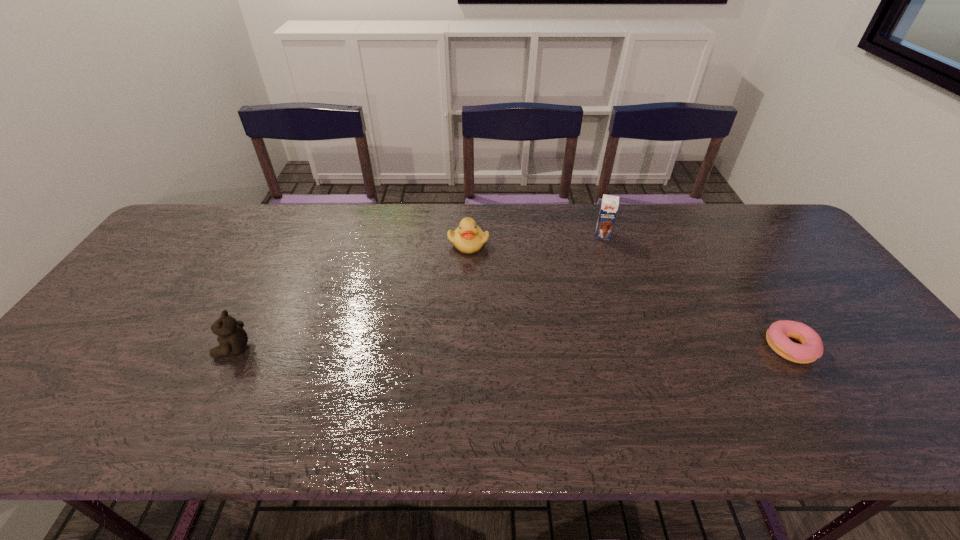
The height and width of the screenshot is (540, 960). Find the location of `vacant space located on the face of the leftmost object`. vacant space located on the face of the leftmost object is located at coordinates (147, 349).

The image size is (960, 540). Identify the location of vacant space located 0.240m on the left of the rightmost object. (668, 347).

At what (x,y) coordinates should I click in order to perform the action: click on vacant space located on the beak of the third tallest object. Please return your answer as a coordinate pair (x, y). The image size is (960, 540). Looking at the image, I should click on (544, 340).

This screenshot has height=540, width=960. What are the coordinates of `vacant point located on the beak of the third tallest object` in the screenshot? It's located at (538, 331).

Image resolution: width=960 pixels, height=540 pixels. Find the location of `vacant area situated 0.090m on the beak of the third tallest object`. vacant area situated 0.090m on the beak of the third tallest object is located at coordinates (492, 272).

Find the location of `vacant space situated 0.110m on the front label of the chocolate milk`. vacant space situated 0.110m on the front label of the chocolate milk is located at coordinates (600, 263).

Locate an element on the screen. free spot located 0.400m on the front label of the chocolate milk is located at coordinates (591, 336).

Identify the location of free space located 0.090m on the front label of the chocolate milk. This screenshot has height=540, width=960. (600, 259).

Locate an element on the screen. The image size is (960, 540). duckling that is at the far edge is located at coordinates coord(468,238).

You are a GUI agent. You are given a task and a screenshot of the screen. Output one action in this format:
    pyautogui.click(x=<x>, y=<y>)
    Task: Click on the chocolate milk at the far edge
    
    Given the screenshot: What is the action you would take?
    pyautogui.click(x=609, y=206)